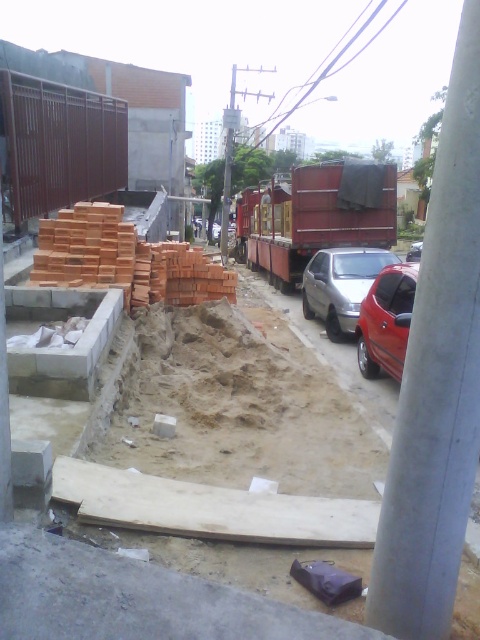
Question: Among these objects, which one is nearest to the camera?

Choices:
 (A) glossy red car at right
 (B) metallic silver car at center

Answer: (A)

Question: Which of the following is the closest to the observer?

Choices:
 (A) brown sandy at center
 (B) orange brick at center
 (C) metallic silver car at center
 (D) glossy red car at right

Answer: (A)

Question: Can you confirm if gray concrete pole at right is positioned below metallic silver car at center?

Choices:
 (A) no
 (B) yes

Answer: (B)

Question: Which object is the farthest from the orange brick at center?

Choices:
 (A) brown sandy at center
 (B) gray concrete pole at right

Answer: (B)

Question: Can you confirm if gray concrete pole at right is positioned below glossy red car at right?

Choices:
 (A) yes
 (B) no

Answer: (A)

Question: Can you confirm if brown sandy at center is bigger than metallic silver car at center?

Choices:
 (A) yes
 (B) no

Answer: (A)